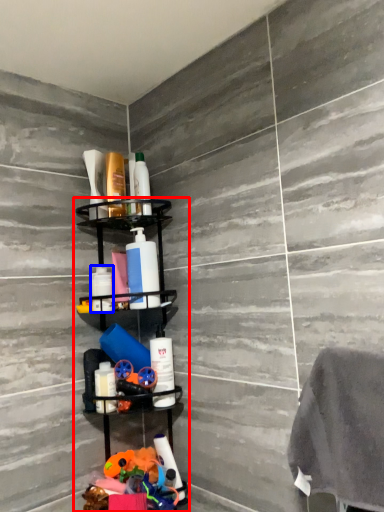
Question: Among these objects, which one is farthest to the camera, shelf (highlighted by a red box) or toiletry (highlighted by a blue box)?

Choices:
 (A) shelf
 (B) toiletry

Answer: (B)